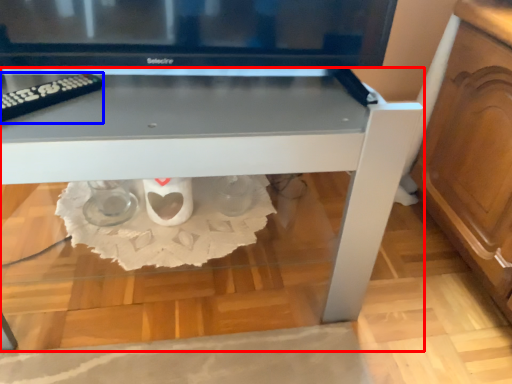
Question: Which point is further to the camera, table (highlighted by a red box) or remote (highlighted by a blue box)?

Choices:
 (A) table
 (B) remote

Answer: (B)